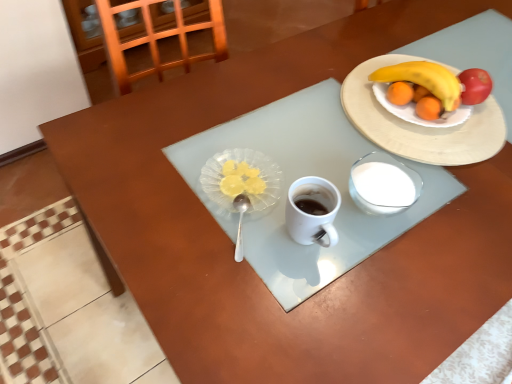
The image size is (512, 384). I want to click on free space in front of yellow matte banana at upper right, so (x=435, y=166).